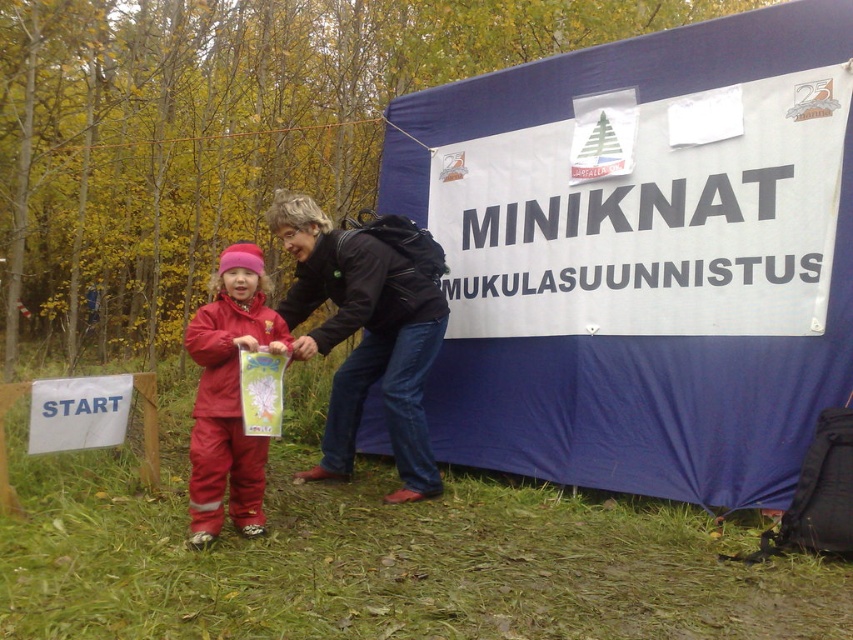
You are a participant in an outdoor event and see the blue fabric tent at center and the matte red snowsuit at center. Which object is taller?

The blue fabric tent at center is much taller than the matte red snowsuit at center.

You are a participant in an outdoor event and need to set up your equipment. You have a blue fabric tent at center and a black leather jacket at center. Based on the scene, which object is placed higher relative to the other?

The blue fabric tent at center is positioned over the black leather jacket at center, meaning the tent is higher up.

You are organizing a small outdoor event and need to set up a registration area. The registration area requires both the blue fabric tent at center and the matte red snowsuit at center to be visible from the START sign. Given their current positions, can both items be seen from the START sign at the same time?

The matte red snowsuit at center is behind the blue fabric tent at center, so the snowsuit may be obstructed from view if the tent is in front. Therefore, both items might not be visible from the START sign simultaneously unless the tent is moved.